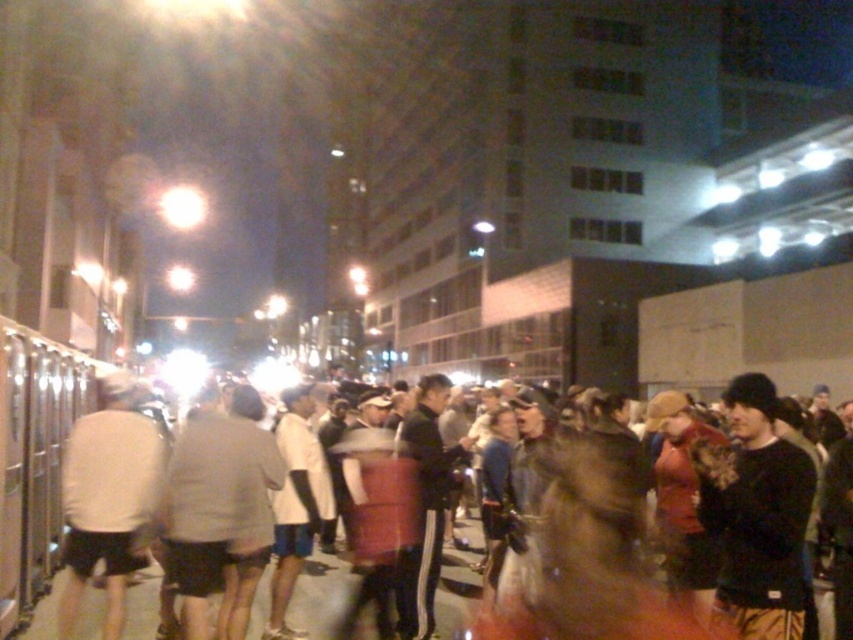
You are a photographer standing in the crowd and want to take a photo of both the white matte shirt at center and the dark gray sweatshirt at center. Since you want both to be fully visible in the photo, which person should you adjust your focus to ensure the taller one is not cropped out?

The dark gray sweatshirt at center is taller than the white matte shirt at center. To ensure the taller person is not cropped out, adjust the focus to include the dark gray sweatshirt at center in the frame.

You are at the event and want to take a photo of both the white matte shirt at center and the dark gray sweatshirt at center. Which clothing item should you zoom in on to ensure it appears larger in your photo?

The dark gray sweatshirt at center is larger in size compared to the white matte shirt at center, so you should zoom in on the dark gray sweatshirt at center to make it appear larger in the photo.